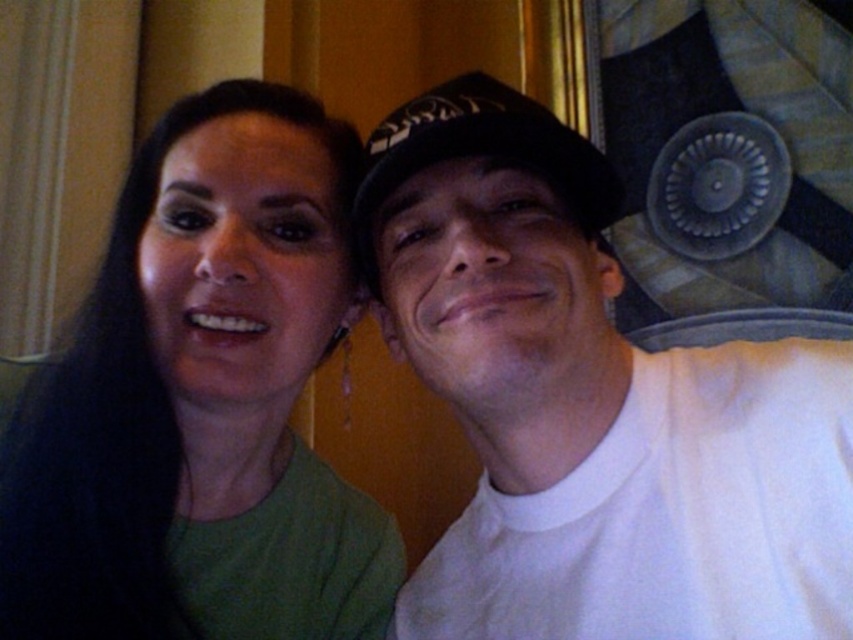
Who is higher up, green matte shirt at left or black fabric baseball hat at center?

black fabric baseball hat at center is higher up.

Does green matte shirt at left have a greater width compared to black fabric baseball hat at center?

Yes.

Does point (268, 320) come behind point (379, 196)?

Yes, it is behind point (379, 196).

Where is `green matte shirt at left`? green matte shirt at left is located at coordinates (201, 401).